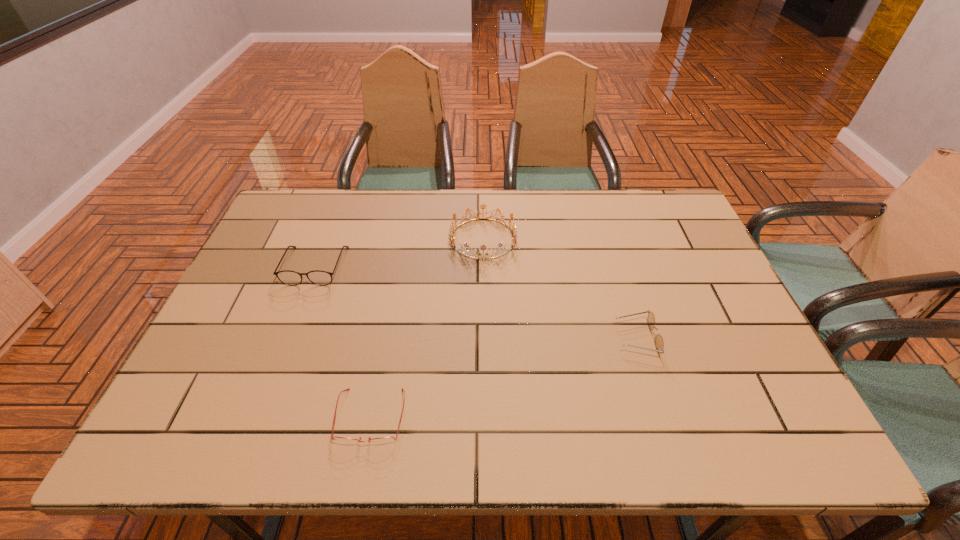
Where is `free space between the tallest object and the third tallest object`? This screenshot has width=960, height=540. free space between the tallest object and the third tallest object is located at coordinates coord(560,288).

The width and height of the screenshot is (960, 540). In order to click on vacant area that lies between the tiara and the farthest spectacles in this screenshot , I will do `click(399, 252)`.

I want to click on free space between the second farthest spectacles and the tiara, so click(x=560, y=288).

Identify which object is located as the third nearest to the farthest spectacles. Please provide its 2D coordinates. Your answer should be formatted as a tuple, i.e. [(x, y)], where the tuple contains the x and y coordinates of a point satisfying the conditions above.

[(659, 344)]

Select which object appears as the second closest to the shortest spectacles. Please provide its 2D coordinates. Your answer should be formatted as a tuple, i.e. [(x, y)], where the tuple contains the x and y coordinates of a point satisfying the conditions above.

[(514, 232)]

Choose which spectacles is the third nearest neighbor to the tallest object. Please provide its 2D coordinates. Your answer should be formatted as a tuple, i.e. [(x, y)], where the tuple contains the x and y coordinates of a point satisfying the conditions above.

[(384, 440)]

Find the location of `spectacles that is the second closest to the farthest spectacles`. spectacles that is the second closest to the farthest spectacles is located at coordinates (659, 344).

Find the location of a particular element. The image size is (960, 540). vacant space that satisfies the following two spatial constraints: 1. on the front-facing side of the third farthest object; 2. on the lenses of the second spectacles from right to left is located at coordinates (660, 416).

Find the location of a particular element. The image size is (960, 540). free space that satisfies the following two spatial constraints: 1. on the front-facing side of the rightmost spectacles; 2. on the lenses of the nearest object is located at coordinates (660, 416).